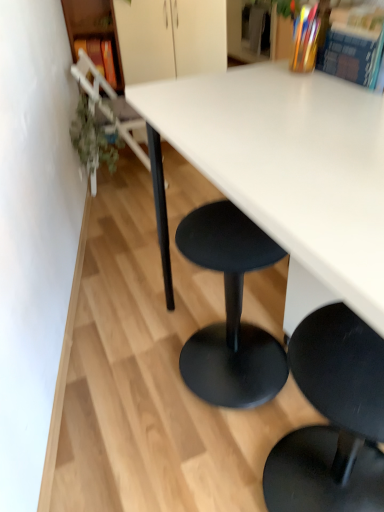
Question: Does point (86, 31) appear closer or farther from the camera than point (134, 152)?

Choices:
 (A) farther
 (B) closer

Answer: (B)

Question: Looking at the image, does wooden bookshelf at left seem bigger or smaller compared to metallic silver chair at left, which is the first chair in back-to-front order?

Choices:
 (A) small
 (B) big

Answer: (A)

Question: Based on their relative distances, which object is farther from the multicolored paper book at upper right, which is the second book in front-to-back order?

Choices:
 (A) metallic silver chair at left, the second chair in the right-to-left sequence
 (B) white matte table at center
 (C) black matte stool at lower right, the second chair viewed from the back
 (D) wooden bookshelf at left
 (E) matte orange book at upper left, which appears as the 1th book when viewed from the back

Answer: (D)

Question: Which of these objects is positioned closest to the metallic silver chair at left, the second chair in the right-to-left sequence?

Choices:
 (A) multicolored paper book at upper right, placed as the second book when sorted from bottom to top
 (B) matte orange book at upper left, the first book from the top
 (C) wooden bookshelf at left
 (D) white matte table at center
 (E) black matte stool at lower right, marked as the second chair in a left-to-right arrangement

Answer: (B)